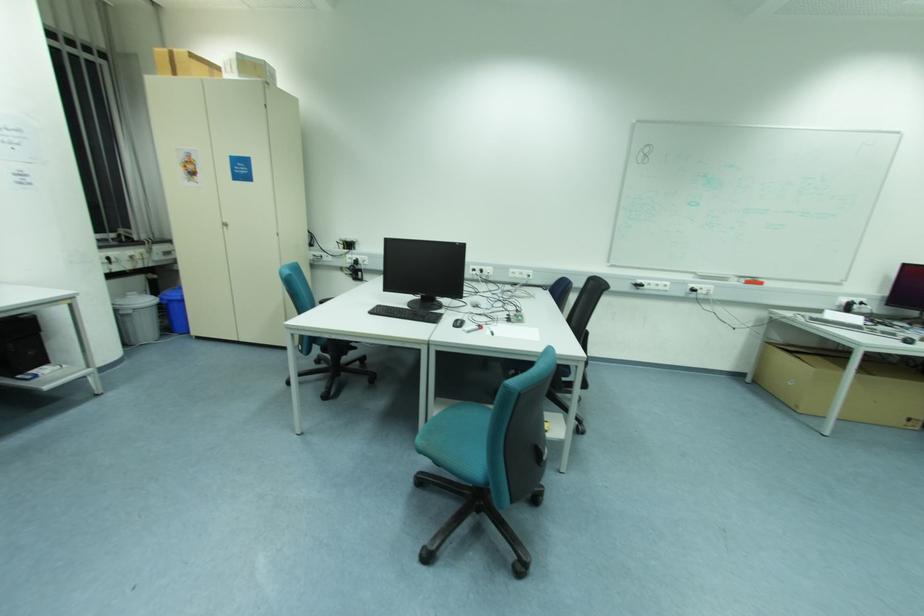
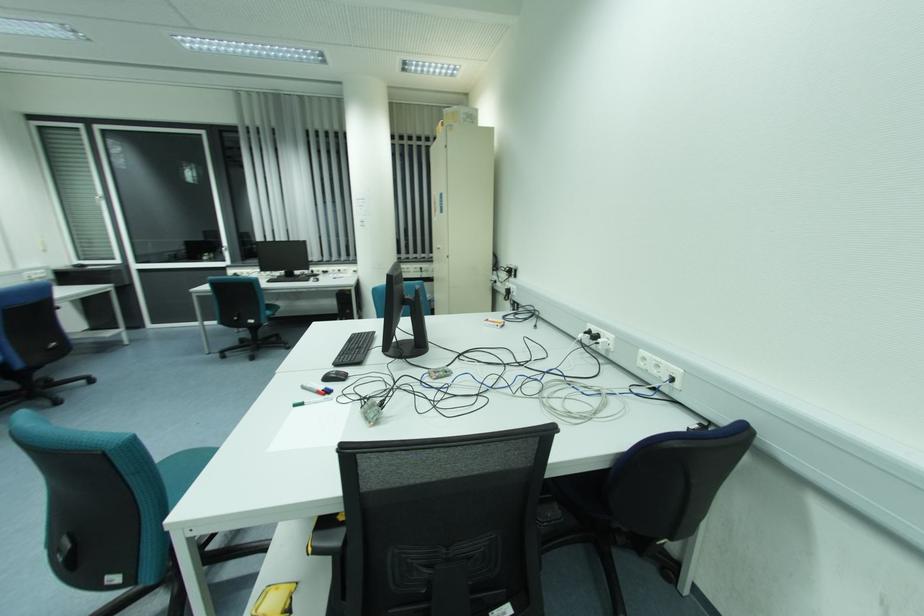
Locate, in the second image, the point that corresponds to [513,270] in the first image.

(642, 352)